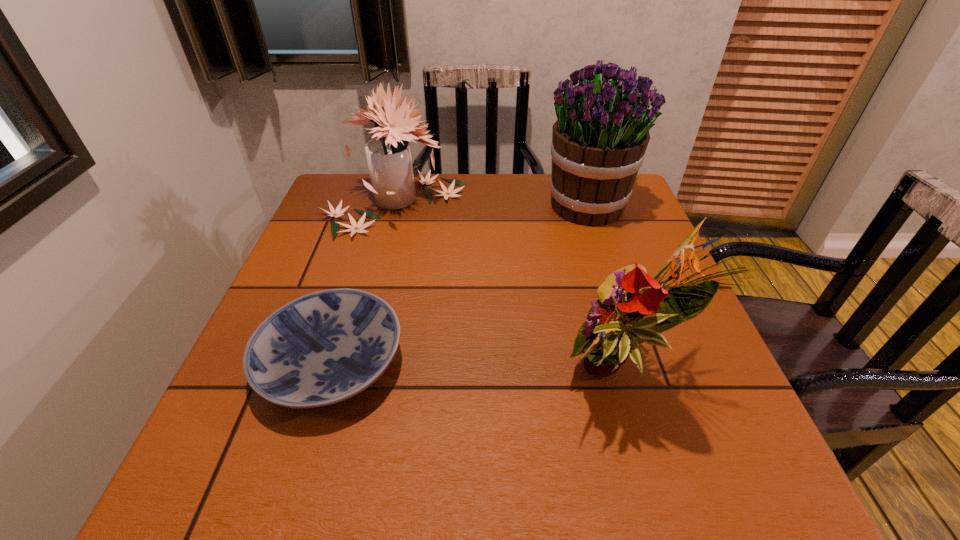
The height and width of the screenshot is (540, 960). I want to click on bouquet that is positioned at the left edge, so click(389, 158).

Locate an element on the screen. plate that is at the left edge is located at coordinates pos(322,348).

At what (x,y) coordinates should I click in order to perform the action: click on object located at the far left corner. Please return your answer as a coordinate pair (x, y). This screenshot has width=960, height=540. Looking at the image, I should click on (389, 158).

Locate an element on the screen. The image size is (960, 540). object that is at the far right corner is located at coordinates click(599, 140).

Image resolution: width=960 pixels, height=540 pixels. Find the location of `free space at the far edge of the desktop`. free space at the far edge of the desktop is located at coordinates (495, 174).

This screenshot has height=540, width=960. What are the coordinates of `free space at the near edge` in the screenshot? It's located at (622, 458).

This screenshot has width=960, height=540. In the image, there is a desktop. In order to click on free space at the left edge in this screenshot , I will do `click(295, 298)`.

In order to click on free region at the right edge of the desktop in this screenshot , I will do `click(589, 232)`.

You are a GUI agent. You are given a task and a screenshot of the screen. Output one action in this format:
    pyautogui.click(x=<x>, y=<y>)
    Task: Click on the free spot at the far left corner of the desktop
    The image size is (960, 540).
    Given the screenshot: What is the action you would take?
    pyautogui.click(x=356, y=180)

Identify the location of free space at the near left corner of the desktop. (275, 462).